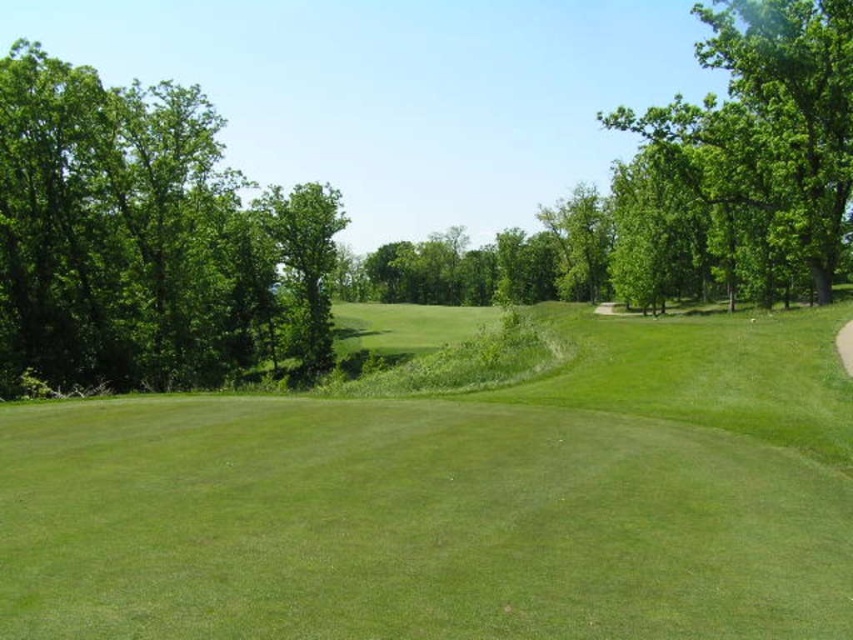
Question: Does green leafy tree at left have a greater width compared to green leafy tree at center?

Choices:
 (A) no
 (B) yes

Answer: (A)

Question: Is green leafy tree at left to the right of green leafy tree at center from the viewer's perspective?

Choices:
 (A) yes
 (B) no

Answer: (A)

Question: Among these points, which one is nearest to the camera?

Choices:
 (A) (292, 348)
 (B) (595, 464)
 (C) (741, 72)
 (D) (329, 360)

Answer: (B)

Question: Which object is closer to the camera taking this photo?

Choices:
 (A) green grassy field at center
 (B) green leafy tree at upper right
 (C) green leafy tree at left

Answer: (A)

Question: Can you confirm if green grassy field at center is positioned to the left of green leafy tree at upper right?

Choices:
 (A) yes
 (B) no

Answer: (A)

Question: Which object appears farthest from the camera in this image?

Choices:
 (A) green leafy tree at left
 (B) green leafy tree at center

Answer: (B)